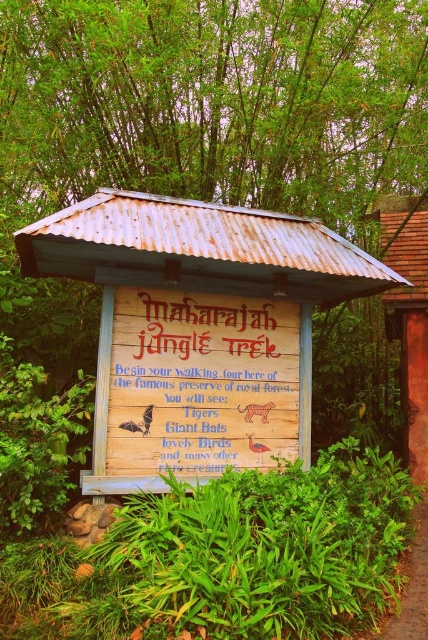
Question: Which point appears farthest from the camera in this image?

Choices:
 (A) (401, 333)
 (B) (172, 451)
 (C) (231, 273)
 (D) (416, 576)

Answer: (A)

Question: Estimate the real-world distances between objects in this image. Which object is farther from the brown dirt path at lower right?

Choices:
 (A) rusty corrugated metal hut at center
 (B) rusty corrugated metal hut at upper right
 (C) wooden sign at center

Answer: (A)

Question: Estimate the real-world distances between objects in this image. Which object is farther from the rusty corrugated metal hut at upper right?

Choices:
 (A) rusty corrugated metal hut at center
 (B) brown dirt path at lower right

Answer: (A)

Question: Does wooden sign at center have a larger size compared to rusty corrugated metal hut at upper right?

Choices:
 (A) no
 (B) yes

Answer: (A)

Question: Is rusty corrugated metal hut at center positioned before wooden sign at center?

Choices:
 (A) yes
 (B) no

Answer: (A)

Question: Is rusty corrugated metal hut at center positioned in front of brown dirt path at lower right?

Choices:
 (A) yes
 (B) no

Answer: (B)